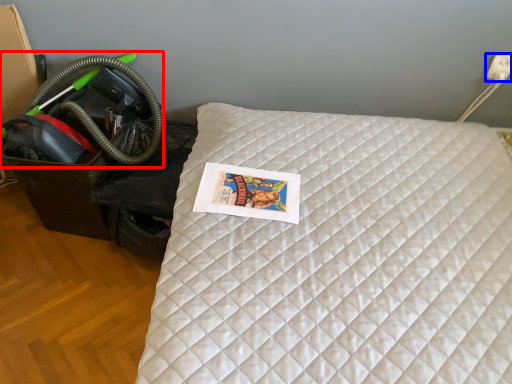
Question: Which object is closer to the camera taking this photo, garden hose (highlighted by a red box) or electric outlet (highlighted by a blue box)?

Choices:
 (A) garden hose
 (B) electric outlet

Answer: (A)